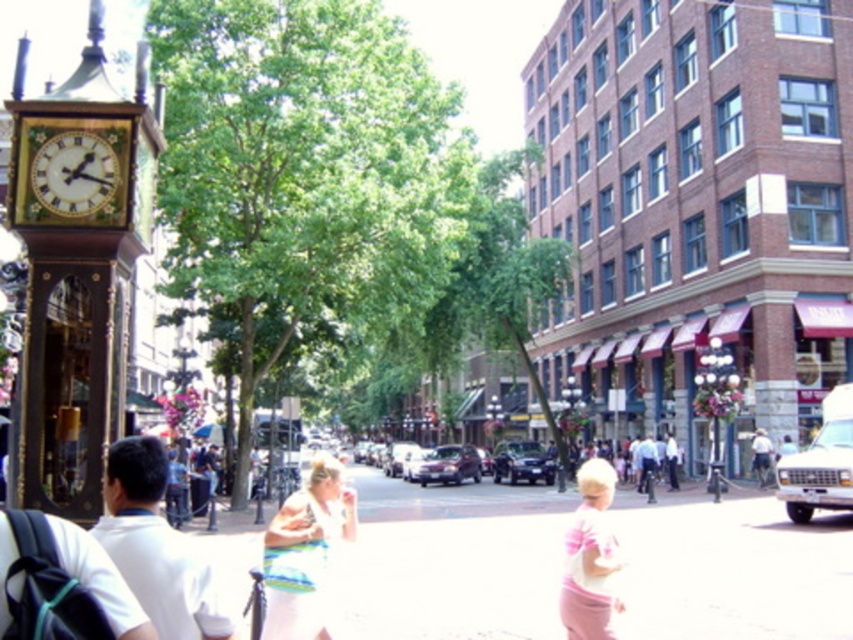
You are a delivery person holding a beige fabric bag at center and need to check the time on the wooden clock at left. Can you see the clock without moving your position?

Yes, because the wooden clock at left is to the left of the beige fabric bag at center, so you can see it from your current position.